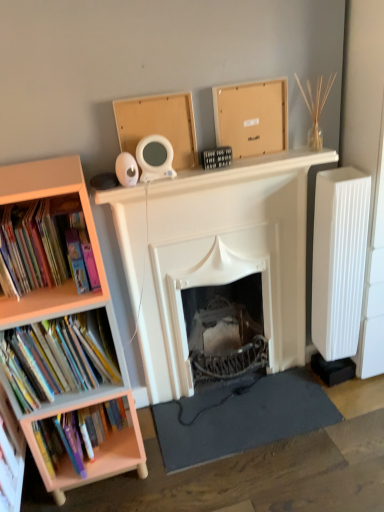
Question: Is white ribbed radiator at right wider or thinner than dark gray rubber mat at lower center?

Choices:
 (A) thin
 (B) wide

Answer: (A)

Question: Considering their positions, is white ribbed radiator at right located in front of or behind dark gray rubber mat at lower center?

Choices:
 (A) front
 (B) behind

Answer: (A)

Question: Which object is the closest to the matte cardboard bookshelf at left, marked as the third book in a bottom-to-top arrangement?

Choices:
 (A) peach wood bookcase at left
 (B) white matte fireplace at center
 (C) hardcover books at left, the second book from the bottom
 (D) matte cardboard box at upper center, which ranks as the 2th cardboard box in right-to-left order
 (E) hardcover books at left, the 3th book in the top-to-bottom sequence

Answer: (A)

Question: Estimate the real-world distances between objects in this image. Which object is closer to the matte cardboard box at upper center, marked as the 1th cardboard box in a left-to-right arrangement?

Choices:
 (A) hardcover books at left, the 3th book in the top-to-bottom sequence
 (B) matte cardboard bookshelf at left, acting as the first book starting from the top
 (C) white ribbed radiator at right
 (D) white matte fireplace at center
 (E) dark gray rubber mat at lower center

Answer: (D)